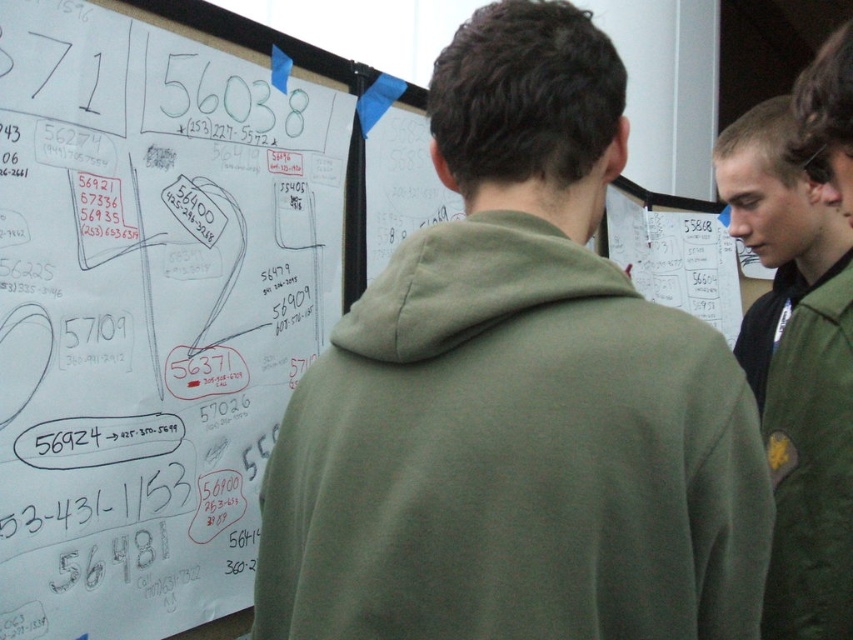
From the picture: Between green matte hoodie at center and white paperboard at upper left, which one is positioned lower?

Positioned lower is green matte hoodie at center.

The height and width of the screenshot is (640, 853). What do you see at coordinates (515, 397) in the screenshot? I see `green matte hoodie at center` at bounding box center [515, 397].

Which is in front, point (445, 412) or point (186, 449)?

Positioned in front is point (445, 412).

What are the coordinates of `green matte hoodie at center` in the screenshot? It's located at (515, 397).

Does white paperboard at upper left have a lesser width compared to green fabric jacket at right?

Incorrect, white paperboard at upper left's width is not less than green fabric jacket at right's.

Who is shorter, white paperboard at upper left or green fabric jacket at right?

Standing shorter between the two is green fabric jacket at right.

This screenshot has width=853, height=640. In order to click on white paperboard at upper left in this screenshot , I will do `click(148, 312)`.

Between point (775, 410) and point (737, 124), which one is positioned behind?

Point (737, 124)

Does green fabric jacket at right appear over green matte jacket at upper right?

No, green fabric jacket at right is not above green matte jacket at upper right.

Image resolution: width=853 pixels, height=640 pixels. Identify the location of green fabric jacket at right. (811, 467).